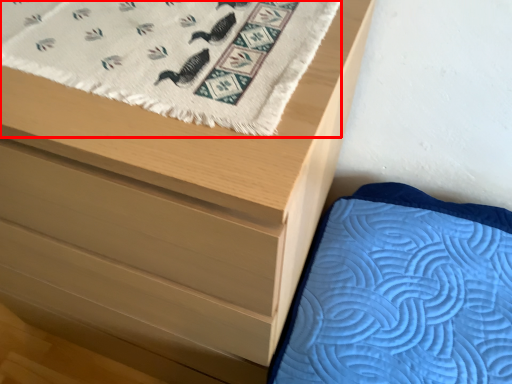
Question: Considering the relative positions of blanket (annotated by the red box) and chest of drawers in the image provided, where is blanket (annotated by the red box) located with respect to the staircase?

Choices:
 (A) left
 (B) right

Answer: (B)